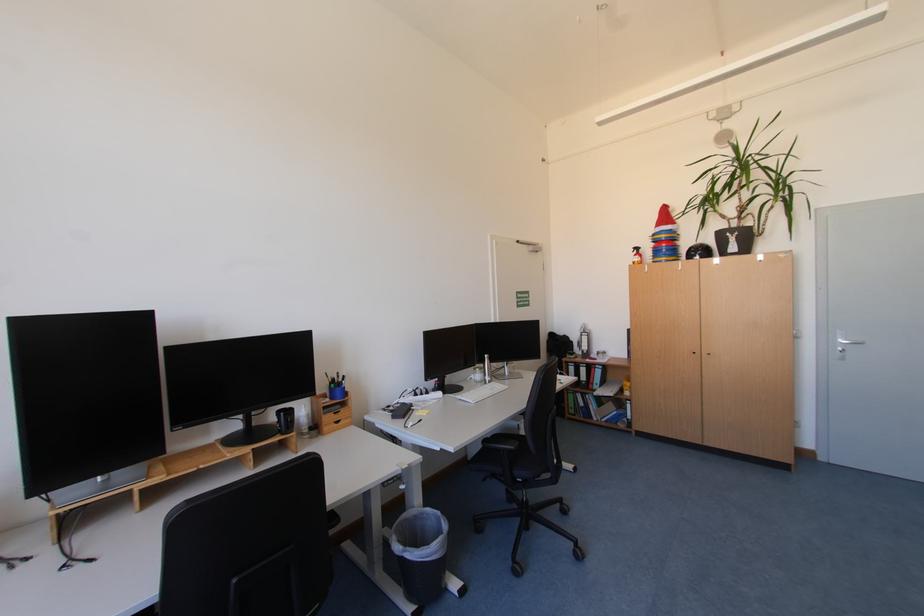
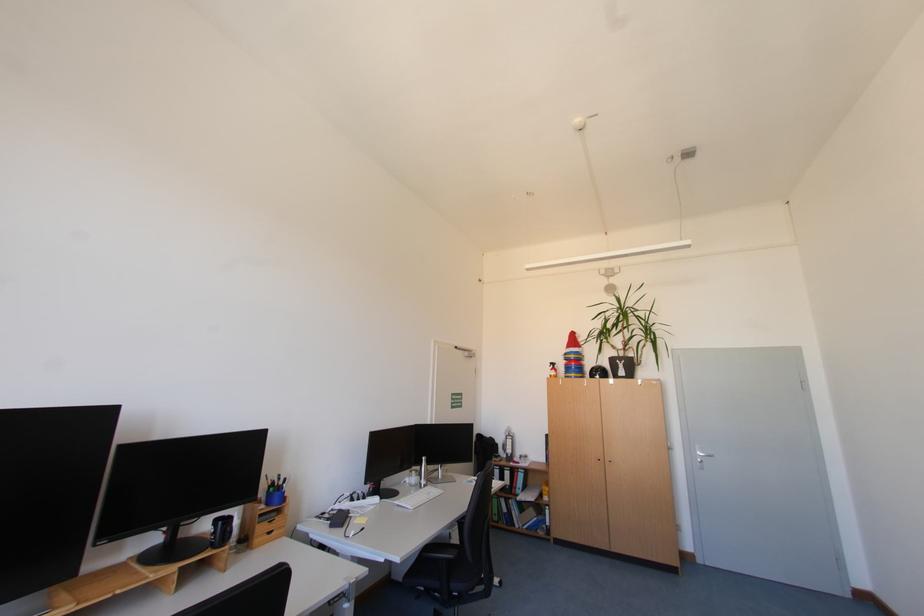
Question: The images are taken continuously from a first-person perspective. In which direction is your viewpoint rotating?

Choices:
 (A) Left
 (B) Right
 (C) Up
 (D) Down

Answer: (C)